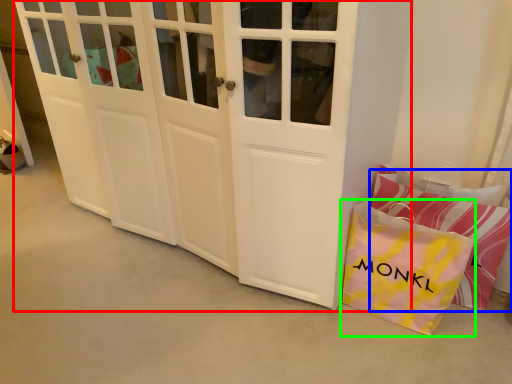
Question: Which object is the closest to the door (highlighted by a red box)? Choose among these: pillow (highlighted by a blue box) or gift bag (highlighted by a green box).

Choices:
 (A) pillow
 (B) gift bag

Answer: (B)